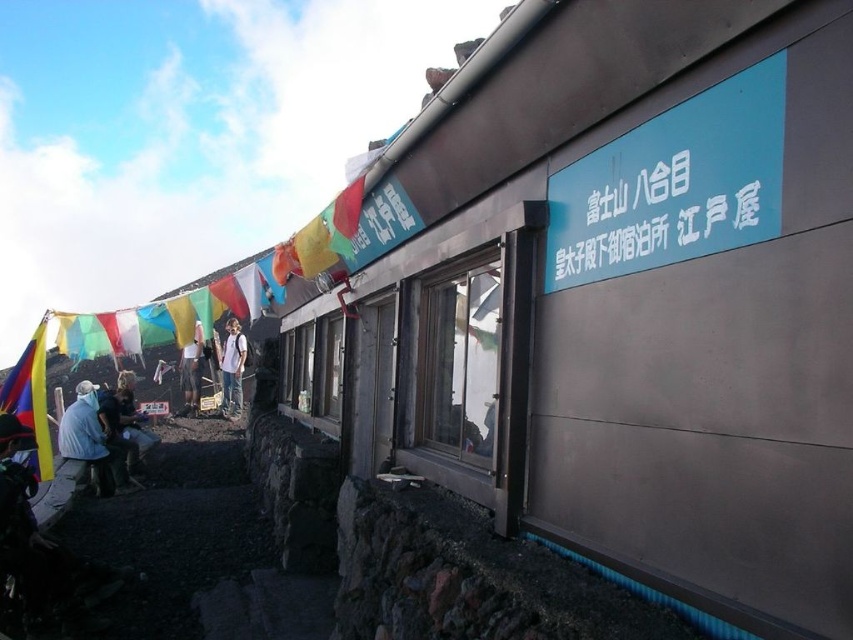
You are a photographer standing in front of the mountain hut. You want to capture both the multicolored fabric flag at left and the white cotton shirt at center in a single frame. Which object should you focus on first to ensure both are in the frame?

The multicolored fabric flag at left is wider than the white cotton shirt at center, so you should focus on the multicolored fabric flag at left first to ensure both objects fit within the frame.

You are a hiker who just arrived at the mountain hut and notice the denim jacket at lower left and the white plastic sign at upper center. Which object is taller?

The denim jacket at lower left is taller than the white plastic sign at upper center.

You are a hiker who just arrived at the mountain hut. You see a denim jacket at lower left and a white plastic sign at upper center. Which object is closer to you?

The denim jacket at lower left is closer to you because it is positioned over the white plastic sign at upper center, indicating it is in front.